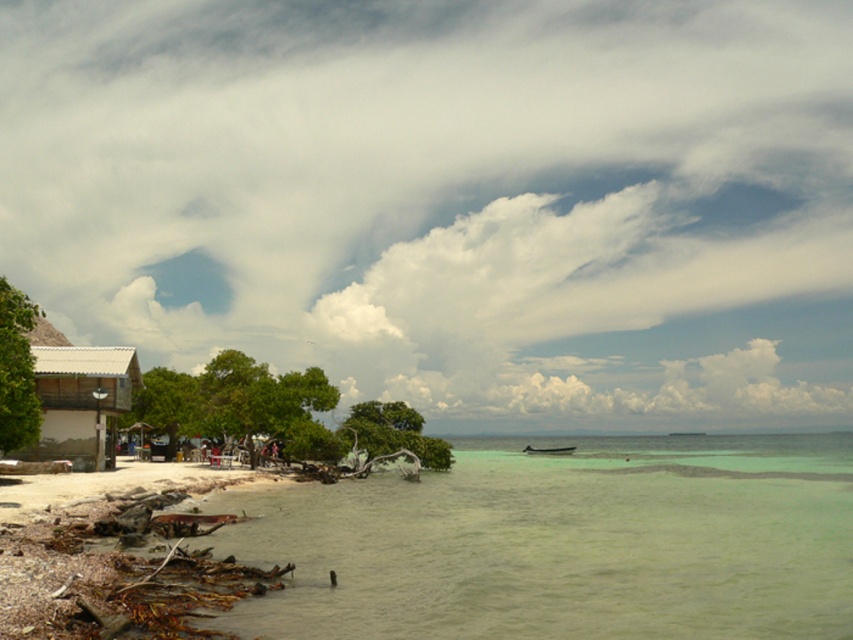
Between white fluffy cloud at upper center and wooden hut at left, which one has more height?

Standing taller between the two is white fluffy cloud at upper center.

Can you confirm if white fluffy cloud at upper center is shorter than wooden hut at left?

No.

You are a GUI agent. You are given a task and a screenshot of the screen. Output one action in this format:
    pyautogui.click(x=<x>, y=<y>)
    Task: Click on the white fluffy cloud at upper center
    The image size is (853, 640).
    Given the screenshot: What is the action you would take?
    pyautogui.click(x=450, y=198)

Does point (691, 477) come closer to viewer compared to point (564, 451)?

Yes, it is.

Does greenish water at lower left appear over white plastic boat at center?

Correct, greenish water at lower left is located above white plastic boat at center.

Which is behind, point (836, 589) or point (543, 448)?

The point (543, 448) is more distant.

The image size is (853, 640). I want to click on greenish water at lower left, so click(x=566, y=544).

Who is positioned more to the left, greenish water at lower left or wooden hut at left?

wooden hut at left

Is point (535, 548) positioned before point (56, 452)?

Yes.

Where is `greenish water at lower left`? greenish water at lower left is located at coordinates (566, 544).